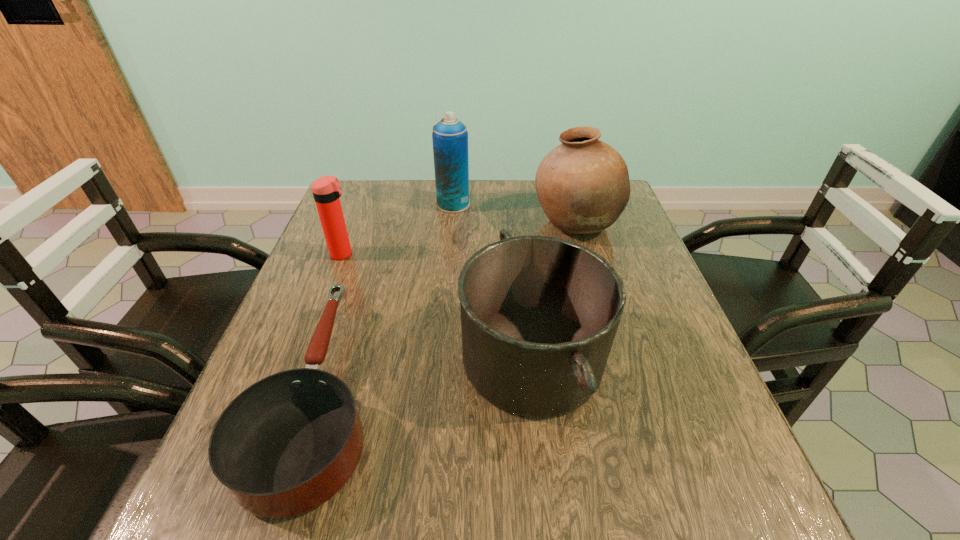
The width and height of the screenshot is (960, 540). I want to click on vacant space at the far edge of the desktop, so click(516, 211).

I want to click on vacant space at the near edge, so click(x=477, y=537).

At what (x,y) coordinates should I click in order to perform the action: click on free region at the left edge of the desktop. Please return your answer as a coordinate pair (x, y). Looking at the image, I should click on (363, 281).

You are a GUI agent. You are given a task and a screenshot of the screen. Output one action in this format:
    pyautogui.click(x=<x>, y=<y>)
    Task: Click on the free space at the right edge of the desktop
    
    Given the screenshot: What is the action you would take?
    pyautogui.click(x=608, y=235)

Locate an element on the screen. vacant space at the far left corner of the desktop is located at coordinates (360, 188).

At what (x,y) coordinates should I click in order to perform the action: click on vacant region at the far right corner of the desktop. Please return your answer as a coordinate pair (x, y). The height and width of the screenshot is (540, 960). Looking at the image, I should click on (629, 215).

Where is `free spot between the thermos bottle and the aerosol can`? This screenshot has width=960, height=540. free spot between the thermos bottle and the aerosol can is located at coordinates (398, 229).

The image size is (960, 540). Identify the location of free space between the pottery and the shortest object. (446, 309).

You are a GUI agent. You are given a task and a screenshot of the screen. Output one action in this format:
    pyautogui.click(x=<x>, y=<y>)
    Task: Click on the empty space between the pan and the aerosol can
    This screenshot has height=540, width=960.
    Given the screenshot: What is the action you would take?
    [386, 300]

Identify the location of free space that is in between the thermos bottle and the pottery. (459, 238).